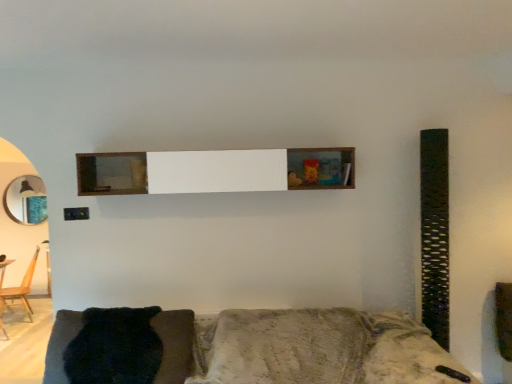
Where is `wooden chair at left`? wooden chair at left is located at coordinates (21, 288).

This screenshot has width=512, height=384. Describe the element at coordinates (319, 349) in the screenshot. I see `textured gray couch at lower center` at that location.

Identify the location of wooden shelf at center. The height and width of the screenshot is (384, 512). (214, 171).

Describe the element at coordinates (214, 171) in the screenshot. I see `wooden shelf at center` at that location.

Identify the location of wooden table at lower left. (4, 270).

Where is `dark fuzzy pillow at lower left`? dark fuzzy pillow at lower left is located at coordinates (114, 347).

Which is more to the left, dark fuzzy pillow at lower left or wooden shelf at center?

dark fuzzy pillow at lower left is more to the left.

Consider the image. Is dark fuzzy pillow at lower left looking in the opposite direction of wooden shelf at center?

dark fuzzy pillow at lower left is not turned away from wooden shelf at center.

The image size is (512, 384). In order to click on pillow in front of the wooden shelf at center in this screenshot , I will do `click(114, 347)`.

From a real-world perspective, which object stands above the other?

wooden shelf at center is physically above.

Is wooden table at lower left oriented away from wooden chair at left?

No.

From the image's perspective, is wooden table at lower left located above wooden chair at left?

No.

Which is closer, (0, 327) or (0, 295)?

Point (0, 327).

Does wooden chair at left have a larger size compared to dark fuzzy pillow at lower left?

Indeed, wooden chair at left has a larger size compared to dark fuzzy pillow at lower left.

Does point (19, 290) appear closer or farther from the camera than point (81, 369)?

Point (19, 290) appears to be farther away from the viewer than point (81, 369).

Is dark fuzzy pillow at lower left surrounded by wooden chair at left?

No, dark fuzzy pillow at lower left is not inside wooden chair at left.

Who is taller, textured gray couch at lower center or metallic circular mirror at left?

metallic circular mirror at left is taller.

Would you say textured gray couch at lower center is to the left or to the right of metallic circular mirror at left in the picture?

Clearly, textured gray couch at lower center is on the right of metallic circular mirror at left in the image.

Is textured gray couch at lower center wider or thinner than metallic circular mirror at left?

In the image, textured gray couch at lower center appears to be wider than metallic circular mirror at left.

Would you say metallic circular mirror at left is part of textured gray couch at lower center's contents?

That's incorrect, metallic circular mirror at left is not inside textured gray couch at lower center.

Does textured gray couch at lower center have a larger size compared to wooden shelf at center?

Yes, textured gray couch at lower center is bigger than wooden shelf at center.

Is textured gray couch at lower center shorter than wooden shelf at center?

Incorrect, the height of textured gray couch at lower center does not fall short of that of wooden shelf at center.

Does point (389, 317) appear closer or farther from the camera than point (250, 176)?

Clearly, point (389, 317) is more distant from the camera than point (250, 176).

From a real-world perspective, relative to wooden shelf at center, is textured gray couch at lower center vertically above or below?

Clearly, from a real-world perspective, textured gray couch at lower center is below wooden shelf at center.

From the image's perspective, which is below, textured gray couch at lower center or wooden table at lower left?

wooden table at lower left, from the image's perspective.

Is textured gray couch at lower center wider or thinner than wooden table at lower left?

In the image, textured gray couch at lower center appears to be wider than wooden table at lower left.

Between point (295, 367) and point (2, 276), which one is positioned behind?

Positioned behind is point (2, 276).

Measure the distance between textured gray couch at lower center and wooden table at lower left.

textured gray couch at lower center is 3.50 meters from wooden table at lower left.

Is dark fuzzy pillow at lower left facing towards wooden chair at left?

No, dark fuzzy pillow at lower left is not oriented towards wooden chair at left.

Is dark fuzzy pillow at lower left inside the boundaries of wooden chair at left, or outside?

dark fuzzy pillow at lower left cannot be found inside wooden chair at left.

From the image's perspective, is dark fuzzy pillow at lower left over wooden chair at left?

Yes, from the image's perspective, dark fuzzy pillow at lower left is on top of wooden chair at left.

Locate an element on the screen. The image size is (512, 384). shelf positioned vertically above the dark fuzzy pillow at lower left (from a real-world perspective) is located at coordinates (214, 171).

At what (x,y) coordinates should I click in order to perform the action: click on table that is on the right side of wooden chair at left. Please return your answer as a coordinate pair (x, y). Looking at the image, I should click on (4, 270).

Looking at the image, which one is located further to dark fuzzy pillow at lower left, wooden shelf at center or wooden chair at left?

Based on the image, wooden chair at left appears to be further to dark fuzzy pillow at lower left.

From the image, which object appears to be nearer to metallic circular mirror at left, wooden shelf at center or dark fuzzy pillow at lower left?

Among the two, wooden shelf at center is located nearer to metallic circular mirror at left.

Which object lies further to the anchor point metallic circular mirror at left, wooden table at lower left or wooden shelf at center?

wooden shelf at center.

When comparing their distances from wooden table at lower left, does metallic circular mirror at left or dark fuzzy pillow at lower left seem further?

dark fuzzy pillow at lower left is further to wooden table at lower left.

In the scene shown: Which object lies nearer to the anchor point wooden shelf at center, textured gray couch at lower center or metallic circular mirror at left?

textured gray couch at lower center lies closer to wooden shelf at center than the other object.

Based on the photo, which object lies nearer to the anchor point textured gray couch at lower center, wooden table at lower left or wooden chair at left?

wooden table at lower left is positioned closer to the anchor textured gray couch at lower center.

Based on their spatial positions, is dark fuzzy pillow at lower left or wooden table at lower left further from wooden chair at left?

dark fuzzy pillow at lower left is positioned further to the anchor wooden chair at left.

Based on their spatial positions, is metallic circular mirror at left or wooden chair at left closer to dark fuzzy pillow at lower left?

metallic circular mirror at left lies closer to dark fuzzy pillow at lower left than the other object.

The image size is (512, 384). Find the location of `chair positioned between textured gray couch at lower center and metallic circular mirror at left from near to far`. chair positioned between textured gray couch at lower center and metallic circular mirror at left from near to far is located at coordinates (21, 288).

You are a GUI agent. You are given a task and a screenshot of the screen. Output one action in this format:
    pyautogui.click(x=<x>, y=<y>)
    Task: Click on the pillow located between textured gray couch at lower center and metallic circular mirror at left in the depth direction
    
    Given the screenshot: What is the action you would take?
    pyautogui.click(x=114, y=347)

This screenshot has height=384, width=512. Find the location of `shelf located between wooden table at lower left and textured gray couch at lower center in the left-right direction`. shelf located between wooden table at lower left and textured gray couch at lower center in the left-right direction is located at coordinates (214, 171).

Where is `pillow located between wooden table at lower left and wooden shelf at center in the left-right direction`? Image resolution: width=512 pixels, height=384 pixels. pillow located between wooden table at lower left and wooden shelf at center in the left-right direction is located at coordinates (114, 347).